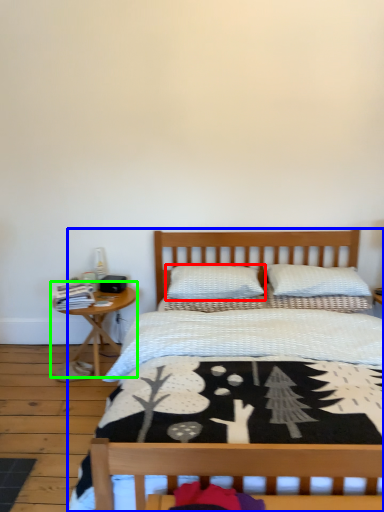
Question: Estimate the real-world distances between objects in this image. Which object is closer to pillow (highlighted by a red box), bed (highlighted by a blue box) or nightstand (highlighted by a green box)?

Choices:
 (A) bed
 (B) nightstand

Answer: (B)